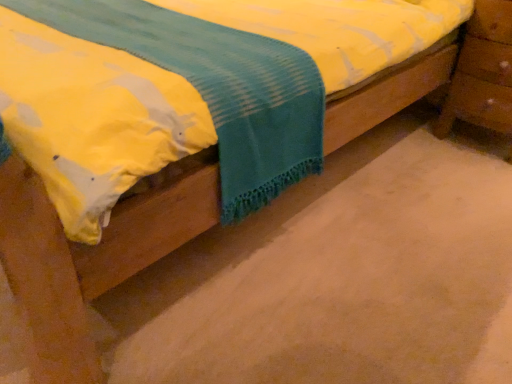
Describe the element at coordinates (482, 72) in the screenshot. The image size is (512, 384). I see `wooden nightstand at lower right` at that location.

At what (x,y) coordinates should I click in order to perform the action: click on wooden nightstand at lower right. Please return your answer as a coordinate pair (x, y). This screenshot has width=512, height=384. Looking at the image, I should click on (482, 72).

This screenshot has width=512, height=384. What are the coordinates of `wooden nightstand at lower right` in the screenshot? It's located at (482, 72).